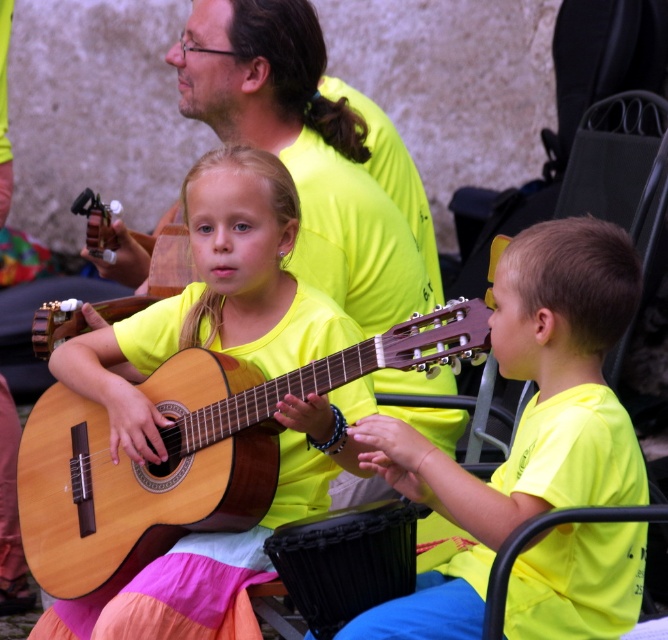
This screenshot has height=640, width=668. What are the coordinates of `yellow matte guitar at right` in the screenshot? It's located at (522, 420).